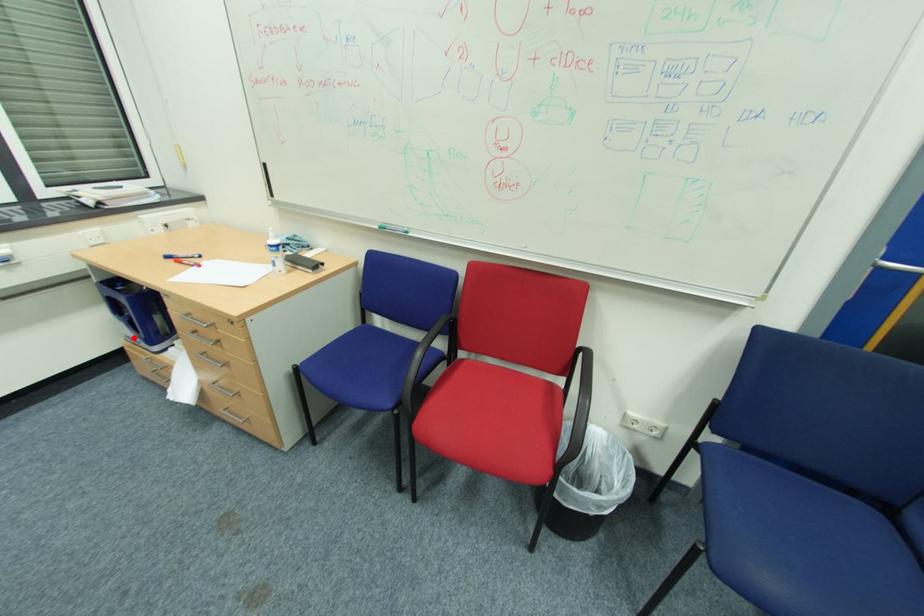
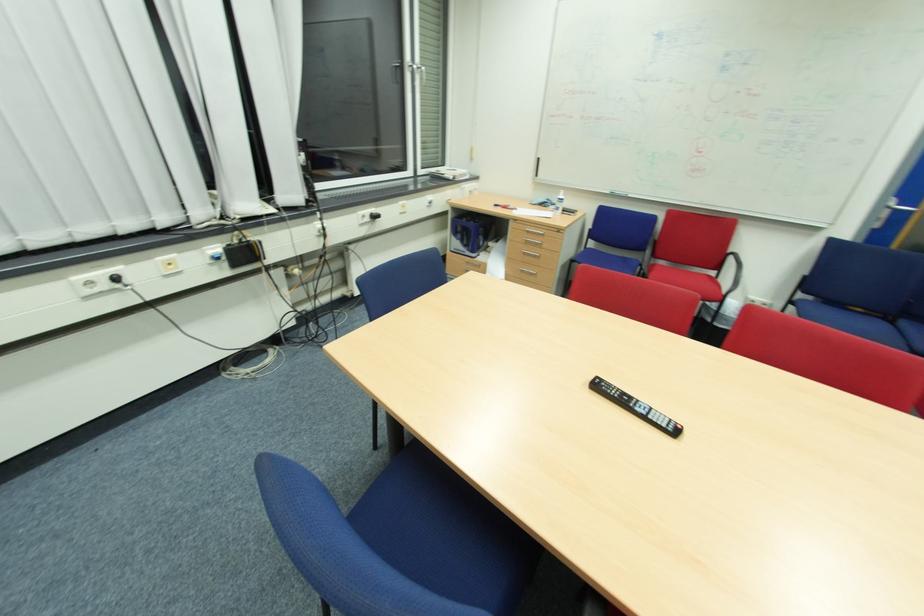
Locate, in the second image, the point that corresponds to the highlighted location in the first image.

(462, 249)